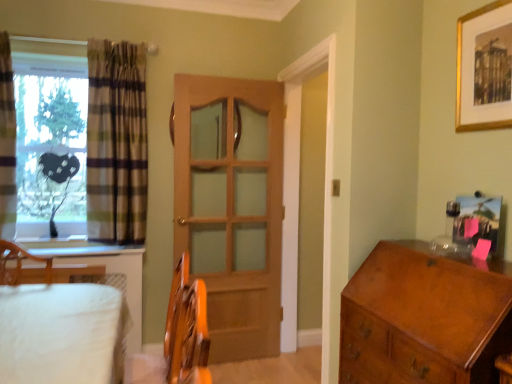
In order to click on free region on the left part of metallic gold picture frame at upper right, arranged as the second picture frame when viewed from the top in this screenshot , I will do `click(440, 257)`.